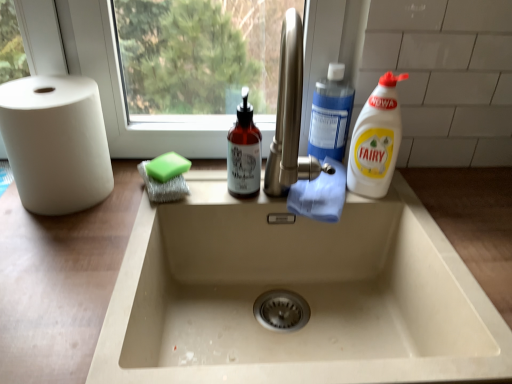
Find the location of a particular element. Image resolution: width=512 pixels, height=384 pixels. free space to the left of translucent amber bottle at center, the first cleaning product in the left-to-right sequence is located at coordinates (170, 203).